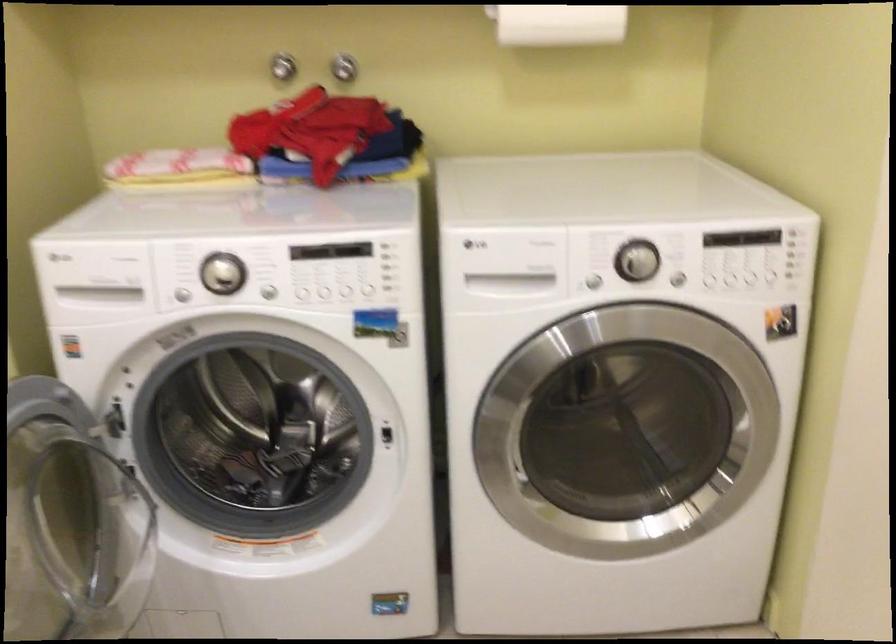
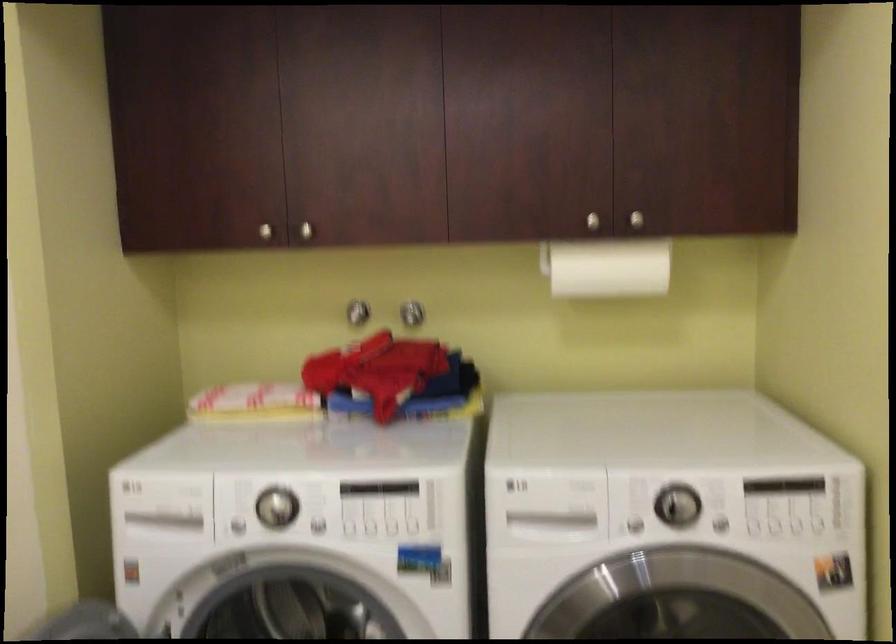
Question: The first image is from the beginning of the video and the second image is from the end. How did the camera likely rotate when shooting the video?

Choices:
 (A) Left
 (B) Right
 (C) Up
 (D) Down

Answer: (C)